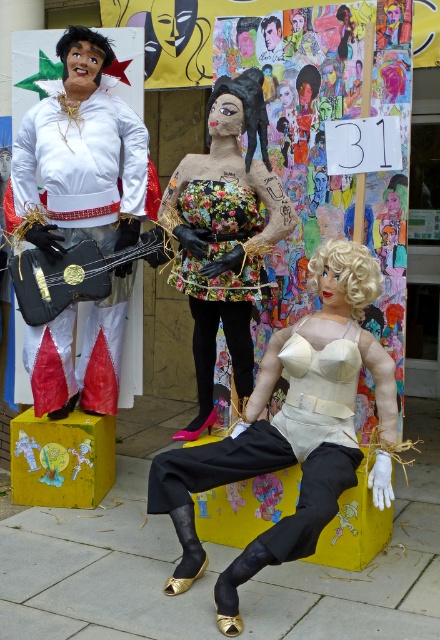
You are a stagehand setting up for a performance. You need to place a 1.20 meter long microphone stand between the matte beige bust at center and the matte black guitar at left. Can you fit it there without moving either object?

The distance between the matte beige bust at center and the matte black guitar at left is 1.40 meters. Since the microphone stand is 1.20 meters long, it can fit in the space between them without needing to move either object.

You are an art curator planning to move the matte black guitar at left and the blonde synthetic wig at center to a new exhibition space. Which object should be moved first to ensure the spatial relationship between them remains consistent with the original installation?

The matte black guitar at left should be moved first because the blonde synthetic wig at center is behind it in the original installation. By moving the guitar first, the wig can then be placed behind it to maintain the original spatial arrangement.